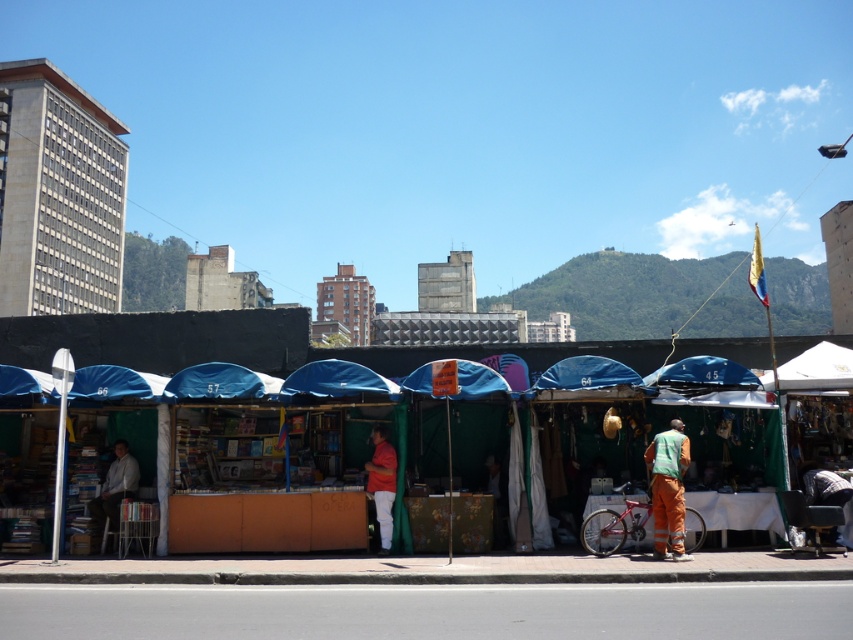
You are a delivery person with a cart that is 3 feet wide. You need to navigate between the blue fabric market stall at center and the matte red shirt at center. Is there enough space for your cart to pass through the gap between them?

The blue fabric market stall at center is 8.82 feet from matte red shirt at center. Since the cart is 3 feet wide, there is sufficient space for the cart to pass through the gap between them as the distance is greater than the cart width.

You are a customer at the market and want to find the largest vendor stand. You see an orange fabric street vendor at lower right and a matte red shirt at center. Which vendor stand is larger?

The orange fabric street vendor at lower right is bigger than the matte red shirt at center, so the orange fabric street vendor at lower right is the larger vendor stand.